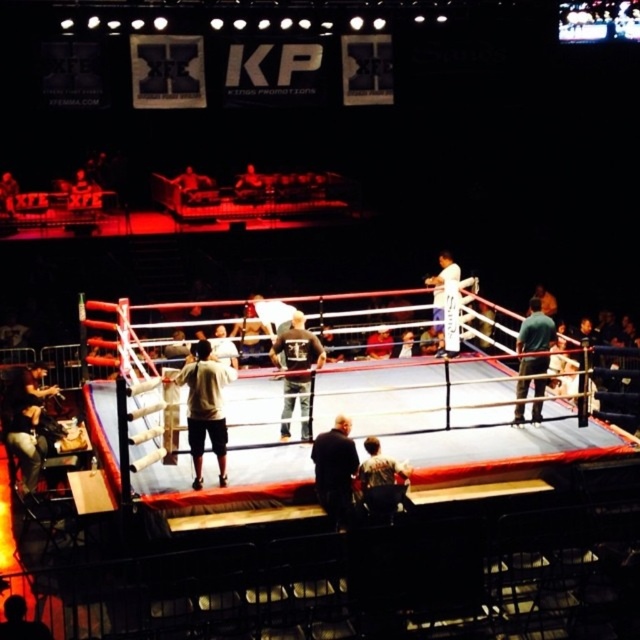
Question: Is dark gray sweatshirt at center to the right of green fabric shirt at center from the viewer's perspective?

Choices:
 (A) yes
 (B) no

Answer: (B)

Question: In this image, where is dark brown leather jacket at center located relative to dark gray sweatshirt at center?

Choices:
 (A) left
 (B) right

Answer: (B)

Question: Based on their relative distances, which object is nearer to the dark brown leather jacket at center?

Choices:
 (A) dark gray sweatshirt at center
 (B) green fabric shirt at center

Answer: (A)

Question: Which is farther from the dark gray sweatshirt at center?

Choices:
 (A) dark brown leather jacket at center
 (B) green fabric shirt at center

Answer: (B)

Question: Which point is farther from the camera taking this photo?

Choices:
 (A) (320, 435)
 (B) (532, 305)
 (C) (280, 340)

Answer: (B)

Question: Does dark brown leather jacket at center appear over dark gray sweatshirt at center?

Choices:
 (A) no
 (B) yes

Answer: (A)